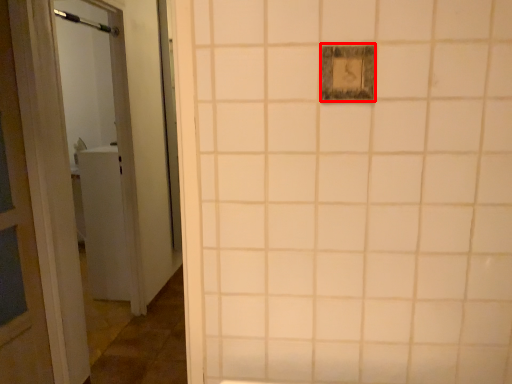
Question: From the image's perspective, where is light switch (annotated by the red box) located in relation to shower in the image?

Choices:
 (A) above
 (B) below

Answer: (B)